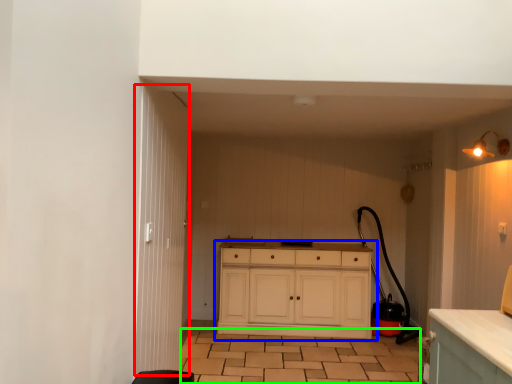
Question: Which object is the farthest from door (highlighted by a red box)? Choose among these: chest of drawers (highlighted by a blue box) or tile (highlighted by a green box).

Choices:
 (A) chest of drawers
 (B) tile

Answer: (A)